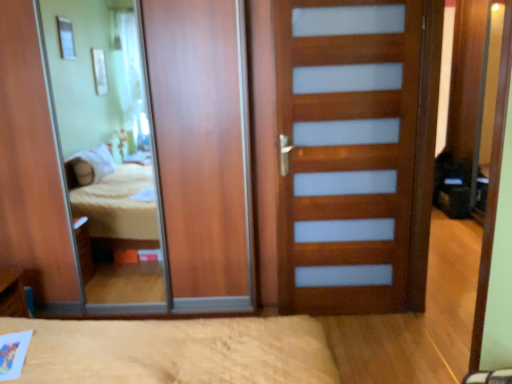
The height and width of the screenshot is (384, 512). What do you see at coordinates (108, 148) in the screenshot?
I see `wooden mirror at center` at bounding box center [108, 148].

The height and width of the screenshot is (384, 512). I want to click on wooden door with frosted panels at center, so click(x=354, y=153).

Does point (396, 168) come farther from viewer compared to point (17, 272)?

No, it is not.

You are a GUI agent. You are given a task and a screenshot of the screen. Output one action in this format:
    pyautogui.click(x=<x>, y=<y>)
    Task: Click on the door above the blue plastic pen at lower left (from the image's perspective)
    This screenshot has height=384, width=512.
    Given the screenshot: What is the action you would take?
    pyautogui.click(x=354, y=153)

Can you confirm if wooden door with frosted panels at center is bigger than blue plastic pen at lower left?

Correct, wooden door with frosted panels at center is larger in size than blue plastic pen at lower left.

Is wooden door with frosted panels at center not close to blue plastic pen at lower left?

wooden door with frosted panels at center is far away from blue plastic pen at lower left.

Does wooden door with frosted panels at center have a smaller size compared to wooden mirror at center?

Indeed, wooden door with frosted panels at center has a smaller size compared to wooden mirror at center.

Considering the relative sizes of wooden door with frosted panels at center and wooden mirror at center in the image provided, is wooden door with frosted panels at center thinner than wooden mirror at center?

In fact, wooden door with frosted panels at center might be wider than wooden mirror at center.

Is wooden door with frosted panels at center looking in the opposite direction of wooden mirror at center?

No, wooden mirror at center is not at the back of wooden door with frosted panels at center.

Can wooden mirror at center be found inside wooden door with frosted panels at center?

No.

In the image, is wooden mirror at center on the left side or the right side of wooden door with frosted panels at center?

Clearly, wooden mirror at center is on the left of wooden door with frosted panels at center in the image.

In the scene shown: Could wooden door with frosted panels at center be considered to be inside wooden mirror at center?

No, wooden door with frosted panels at center is located outside of wooden mirror at center.

Which of these two, wooden mirror at center or wooden door with frosted panels at center, stands shorter?

Standing shorter between the two is wooden door with frosted panels at center.

Considering the sizes of objects blue plastic pen at lower left and wooden mirror at center in the image provided, who is thinner, blue plastic pen at lower left or wooden mirror at center?

Thinner between the two is wooden mirror at center.

Considering the sizes of objects blue plastic pen at lower left and wooden mirror at center in the image provided, who is taller, blue plastic pen at lower left or wooden mirror at center?

Standing taller between the two is wooden mirror at center.

Between blue plastic pen at lower left and wooden mirror at center, which one has larger size?

wooden mirror at center.

Is blue plastic pen at lower left touching wooden mirror at center?

blue plastic pen at lower left and wooden mirror at center are not in contact.

Relative to blue plastic pen at lower left, is wooden mirror at center in front or behind?

Visually, wooden mirror at center is located behind blue plastic pen at lower left.

Is wooden mirror at center surrounding blue plastic pen at lower left?

No, wooden mirror at center does not contain blue plastic pen at lower left.

How much distance is there between wooden mirror at center and blue plastic pen at lower left?

The distance of wooden mirror at center from blue plastic pen at lower left is 5.83 feet.

Find the location of a particular element. Image resolution: width=512 pixels, height=384 pixels. table in front of the wooden mirror at center is located at coordinates click(12, 293).

From the picture: Is blue plastic pen at lower left in contact with wooden door with frosted panels at center?

No, blue plastic pen at lower left is not in contact with wooden door with frosted panels at center.

From a real-world perspective, does blue plastic pen at lower left sit lower than wooden door with frosted panels at center?

Yes, from a real-world perspective, blue plastic pen at lower left is below wooden door with frosted panels at center.

Considering the positions of points (4, 307) and (339, 84), is point (4, 307) farther from camera compared to point (339, 84)?

No, it is in front of (339, 84).

Which object is positioned more to the right, blue plastic pen at lower left or wooden door with frosted panels at center?

Positioned to the right is wooden door with frosted panels at center.

Find the location of `table behind the wooden door with frosted panels at center`. table behind the wooden door with frosted panels at center is located at coordinates (12, 293).

At what (x,y) coordinates should I click in order to perform the action: click on door to the right of wooden mirror at center. Please return your answer as a coordinate pair (x, y). Looking at the image, I should click on (354, 153).

Looking at the image, which one is located closer to wooden mirror at center, wooden door with frosted panels at center or blue plastic pen at lower left?

blue plastic pen at lower left is positioned closer to the anchor wooden mirror at center.

Considering their positions, is blue plastic pen at lower left positioned closer to wooden mirror at center than wooden door with frosted panels at center?

blue plastic pen at lower left is closer to wooden mirror at center.

In the scene shown: Estimate the real-world distances between objects in this image. Which object is further from wooden door with frosted panels at center, blue plastic pen at lower left or wooden mirror at center?

Among the two, blue plastic pen at lower left is located further to wooden door with frosted panels at center.

Based on their spatial positions, is wooden mirror at center or blue plastic pen at lower left closer to wooden door with frosted panels at center?

wooden mirror at center lies closer to wooden door with frosted panels at center than the other object.

Looking at the image, which one is located further to blue plastic pen at lower left, wooden door with frosted panels at center or wooden mirror at center?

The object further to blue plastic pen at lower left is wooden door with frosted panels at center.

From the image, which object appears to be farther from blue plastic pen at lower left, wooden mirror at center or wooden door with frosted panels at center?

Based on the image, wooden door with frosted panels at center appears to be further to blue plastic pen at lower left.

Where is `mirror between blue plastic pen at lower left and wooden door with frosted panels at center from left to right`? mirror between blue plastic pen at lower left and wooden door with frosted panels at center from left to right is located at coordinates (108, 148).